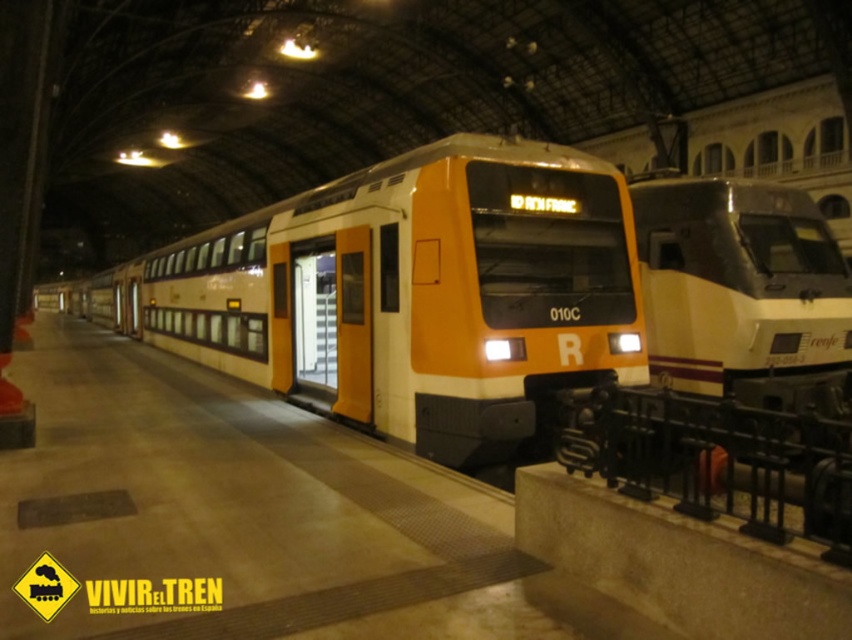
Question: Does matte yellow train at center come in front of black wrought iron rail at lower right?

Choices:
 (A) yes
 (B) no

Answer: (B)

Question: Which object appears farthest from the camera in this image?

Choices:
 (A) black wrought iron rail at lower right
 (B) matte yellow train at center
 (C) matte orange train at center

Answer: (B)

Question: Is matte orange train at center further to the viewer compared to matte yellow train at center?

Choices:
 (A) yes
 (B) no

Answer: (B)

Question: Which of the following is the farthest from the observer?

Choices:
 (A) (646, 401)
 (B) (741, 321)

Answer: (B)

Question: Among these points, which one is farthest from the camera?

Choices:
 (A) (672, 221)
 (B) (701, 429)
 (C) (194, 356)

Answer: (C)

Question: Does matte orange train at center have a smaller size compared to matte yellow train at center?

Choices:
 (A) yes
 (B) no

Answer: (B)